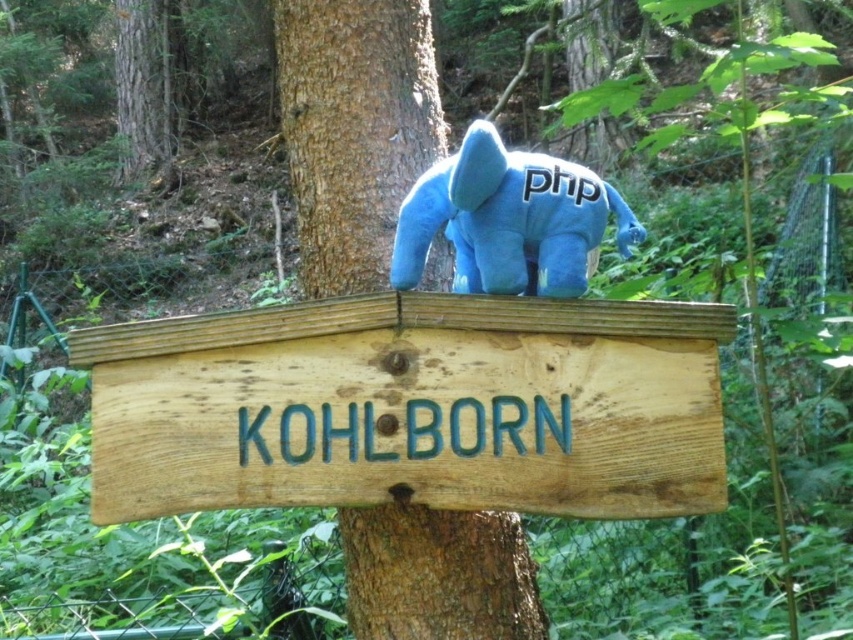
Question: Can you confirm if brown rough wood sign at center is smaller than blue plush toy at center?

Choices:
 (A) yes
 (B) no

Answer: (A)

Question: Is brown rough wood sign at center closer to the viewer compared to blue plush toy at center?

Choices:
 (A) no
 (B) yes

Answer: (A)

Question: Which point is farther to the camera?

Choices:
 (A) (486, 173)
 (B) (328, 19)

Answer: (B)

Question: Does brown rough wood sign at center have a lesser width compared to blue plush toy at center?

Choices:
 (A) no
 (B) yes

Answer: (B)

Question: Which object appears farthest from the camera in this image?

Choices:
 (A) blue plush toy at center
 (B) brown rough wood sign at center

Answer: (B)

Question: Which object is closer to the camera taking this photo?

Choices:
 (A) brown rough wood sign at center
 (B) blue plush toy at center
 (C) brown wood sign at center

Answer: (B)